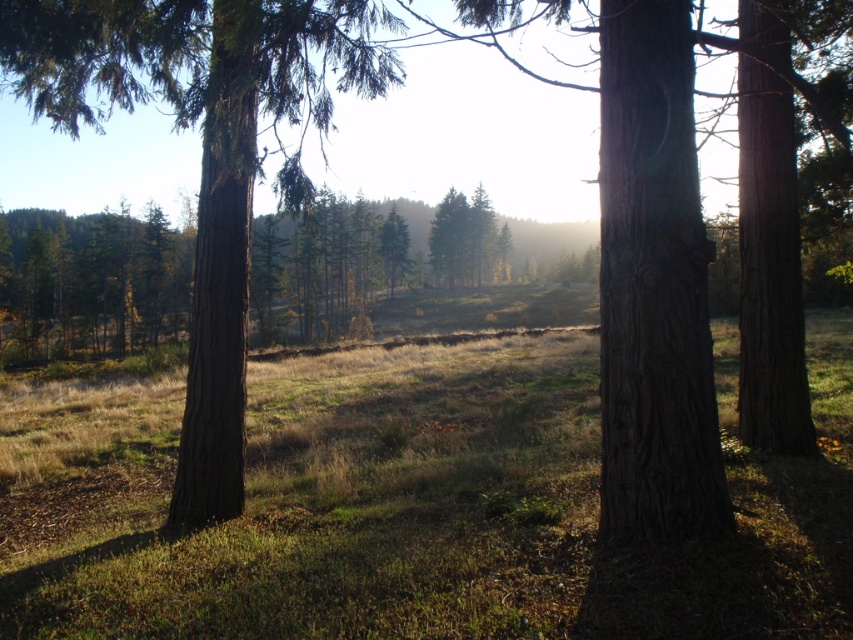
Question: Does green grassy field at center have a smaller size compared to smooth brown tree trunk at center?

Choices:
 (A) no
 (B) yes

Answer: (B)

Question: Is green grassy field at center to the right of smooth brown tree trunk at center from the viewer's perspective?

Choices:
 (A) yes
 (B) no

Answer: (A)

Question: Is green grassy field at center thinner than smooth brown tree trunk at center?

Choices:
 (A) no
 (B) yes

Answer: (B)

Question: Which of the following is the closest to the observer?

Choices:
 (A) (47, 90)
 (B) (74, 625)

Answer: (B)

Question: Among these objects, which one is farthest from the camera?

Choices:
 (A) smooth brown tree trunk at center
 (B) green grassy field at center

Answer: (A)